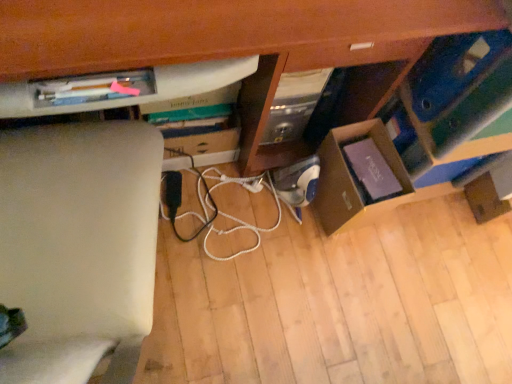
Find the location of `white cord at center`. white cord at center is located at coordinates (215, 205).

This screenshot has height=384, width=512. What do you see at coordinates (359, 176) in the screenshot? I see `cardboard box at lower right` at bounding box center [359, 176].

In the scene shown: What is the approximate height of cardboard box at lower right?

It is 12.29 inches.

Find the location of a particular element. Image resolution: width=512 pixels, height=384 pixels. white cord at center is located at coordinates (215, 205).

Is cardboard box at lower right directly adjacent to blue cardboard box at lower right?

Yes, cardboard box at lower right is right next to blue cardboard box at lower right and making contact.

Is cardboard box at lower right inside the boundaries of blue cardboard box at lower right, or outside?

cardboard box at lower right cannot be found inside blue cardboard box at lower right.

Is cardboard box at lower right looking in the opposite direction of blue cardboard box at lower right?

No.

Does wooden computer desk at center appear on the left side of blue cardboard box at lower right?

Correct, you'll find wooden computer desk at center to the left of blue cardboard box at lower right.

From a real-world perspective, does wooden computer desk at center sit lower than blue cardboard box at lower right?

No, from a real-world perspective, wooden computer desk at center is not below blue cardboard box at lower right.

Does wooden computer desk at center have a smaller size compared to blue cardboard box at lower right?

Actually, wooden computer desk at center might be larger than blue cardboard box at lower right.

From a real-world perspective, does cardboard box at lower right sit lower than white cord at center?

No, from a real-world perspective, cardboard box at lower right is not beneath white cord at center.

The width and height of the screenshot is (512, 384). Find the location of `cardboard box lying on the right of white cord at center`. cardboard box lying on the right of white cord at center is located at coordinates (359, 176).

Considering the relative sizes of cardboard box at lower right and white cord at center in the image provided, is cardboard box at lower right shorter than white cord at center?

No.

Is cardboard box at lower right turned away from white cord at center?

Answer: No.

Where is `shelf that appears on the right of wooden computer desk at center`? shelf that appears on the right of wooden computer desk at center is located at coordinates (422, 132).

From the image's perspective, is blue cardboard box at lower right over wooden computer desk at center?

No.

Does blue cardboard box at lower right have a larger size compared to wooden computer desk at center?

No, blue cardboard box at lower right is not bigger than wooden computer desk at center.

How different are the orientations of blue cardboard box at lower right and wooden computer desk at center in degrees?

The facing directions of blue cardboard box at lower right and wooden computer desk at center are 1.84 degrees apart.

Is white cord at center taller or shorter than cardboard box at lower right?

Clearly, white cord at center is shorter compared to cardboard box at lower right.

Consider the image. How many degrees apart are the facing directions of white cord at center and cardboard box at lower right?

The angle between the facing direction of white cord at center and the facing direction of cardboard box at lower right is 0.000581 degrees.

Is white cord at center at the right side of cardboard box at lower right?

In fact, white cord at center is to the left of cardboard box at lower right.

Is white cord at center not within cardboard box at lower right?

Yes.

Is white cord at center taller than wooden computer desk at center?

Incorrect, the height of white cord at center is not larger of that of wooden computer desk at center.

From a real-world perspective, between white cord at center and wooden computer desk at center, who is vertically lower?

white cord at center, from a real-world perspective.

Is there a large distance between white cord at center and wooden computer desk at center?

No, white cord at center is not far away from wooden computer desk at center.

Considering the points (225, 215) and (343, 215), which point is in front, point (225, 215) or point (343, 215)?

Point (343, 215)

Is white cord at center looking in the opposite direction of blue cardboard box at lower right?

No, blue cardboard box at lower right is not at the back of white cord at center.

Is the position of white cord at center less distant than that of blue cardboard box at lower right?

No, white cord at center is further to the viewer.

Who is taller, white cord at center or blue cardboard box at lower right?

Standing taller between the two is blue cardboard box at lower right.

Find the location of a particular element. shelf on the right of cardboard box at lower right is located at coordinates (422, 132).

This screenshot has height=384, width=512. What are the coordinates of `computer desk above the blue cardboard box at lower right (from the image's perspective)` in the screenshot? It's located at (240, 45).

Based on the photo, based on their spatial positions, is cardboard box at lower right or wooden computer desk at center further from white cord at center?

wooden computer desk at center.

Which object lies further to the anchor point white cord at center, blue cardboard box at lower right or wooden computer desk at center?

Among the two, blue cardboard box at lower right is located further to white cord at center.

Looking at the image, which one is located further to white cord at center, blue cardboard box at lower right or cardboard box at lower right?

blue cardboard box at lower right lies further to white cord at center than the other object.

Looking at the image, which one is located further to cardboard box at lower right, wooden computer desk at center or blue cardboard box at lower right?

Based on the image, wooden computer desk at center appears to be further to cardboard box at lower right.

Estimate the real-world distances between objects in this image. Which object is closer to cardboard box at lower right, wooden computer desk at center or white cord at center?

Among the two, wooden computer desk at center is located nearer to cardboard box at lower right.

When comparing their distances from blue cardboard box at lower right, does wooden computer desk at center or cardboard box at lower right seem further?

wooden computer desk at center is further to blue cardboard box at lower right.

Considering their positions, is blue cardboard box at lower right positioned closer to wooden computer desk at center than cardboard box at lower right?

blue cardboard box at lower right.

Considering their positions, is blue cardboard box at lower right positioned closer to wooden computer desk at center than white cord at center?

blue cardboard box at lower right.

Identify the location of cardboard box situated between wooden computer desk at center and blue cardboard box at lower right from left to right. The image size is (512, 384). (359, 176).

Where is `cardboard box between wooden computer desk at center and white cord at center in the front-back direction`? The height and width of the screenshot is (384, 512). cardboard box between wooden computer desk at center and white cord at center in the front-back direction is located at coordinates (359, 176).

At what (x,y) coordinates should I click in order to perform the action: click on cardboard box between white cord at center and blue cardboard box at lower right. Please return your answer as a coordinate pair (x, y). Looking at the image, I should click on (359, 176).

Identify the location of string between wooden computer desk at center and blue cardboard box at lower right. (215, 205).